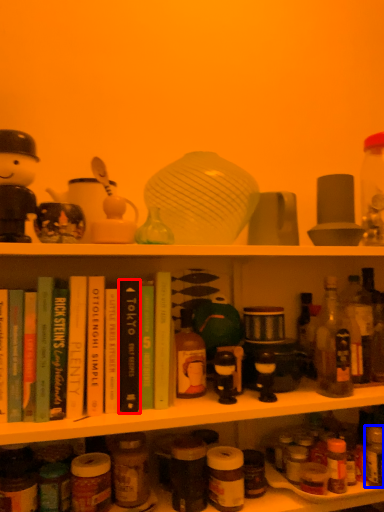
Question: Which of the following is the farthest to the observer, book (highlighted by a red box) or bottle (highlighted by a blue box)?

Choices:
 (A) book
 (B) bottle

Answer: (B)